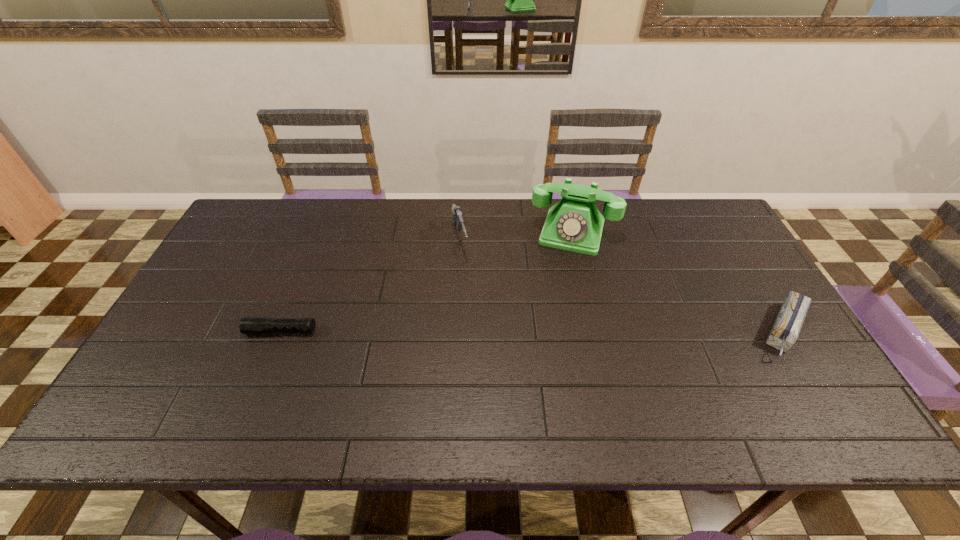
At what (x,y) coordinates should I click in order to perform the action: click on vacant space in between the third shortest object and the leftmost object. Please return your answer as a coordinate pair (x, y). The width and height of the screenshot is (960, 540). Looking at the image, I should click on (371, 286).

This screenshot has height=540, width=960. Find the location of `empty location between the flashlight and the third object from right to left`. empty location between the flashlight and the third object from right to left is located at coordinates (371, 286).

Where is `blank region between the telephone and the pencil box`? The height and width of the screenshot is (540, 960). blank region between the telephone and the pencil box is located at coordinates (678, 281).

This screenshot has width=960, height=540. Identify the location of free space between the pencil box and the flashlight. (533, 331).

Locate an element on the screen. Image resolution: width=960 pixels, height=540 pixels. blank region between the third object from right to left and the leftmost object is located at coordinates (371, 286).

Identify the location of empty space that is in between the second object from left to right and the pencil box. (622, 286).

This screenshot has width=960, height=540. Find the location of `blank region between the pencil box and the flashlight`. blank region between the pencil box and the flashlight is located at coordinates (533, 331).

Identify which object is the second nearest to the pencil box. Please provide its 2D coordinates. Your answer should be formatted as a tuple, i.e. [(x, y)], where the tuple contains the x and y coordinates of a point satisfying the conditions above.

[(457, 217)]

Identify which object is the third nearest to the flashlight. Please provide its 2D coordinates. Your answer should be formatted as a tuple, i.e. [(x, y)], where the tuple contains the x and y coordinates of a point satisfying the conditions above.

[(785, 331)]